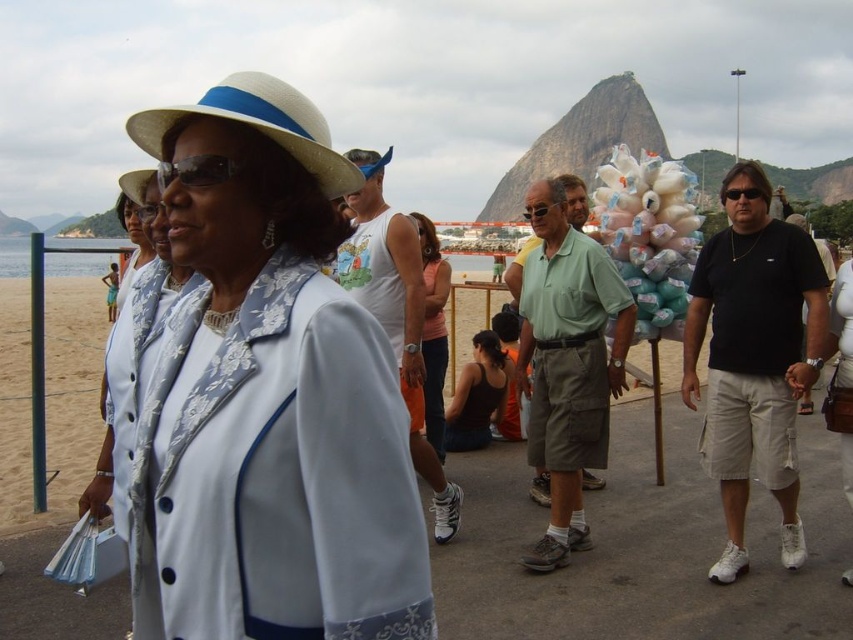
Is black cotton shirt at center above white tank top at center?

Actually, black cotton shirt at center is below white tank top at center.

Does black cotton shirt at center have a greater width compared to white tank top at center?

Indeed, black cotton shirt at center has a greater width compared to white tank top at center.

Does point (804, 358) come farther from viewer compared to point (355, 211)?

No, (804, 358) is closer to viewer.

The image size is (853, 640). I want to click on black cotton shirt at center, so click(x=753, y=356).

Is white fabric at center thinner than orange fabric tank top at center?

No.

Is point (86, 460) behind point (444, 291)?

No, (86, 460) is in front of (444, 291).

Is point (111, 593) positioned after point (428, 328)?

That is False.

Where is `white fabric at center`? white fabric at center is located at coordinates (643, 547).

Does point (152, 109) lie behind point (350, 196)?

That is False.

Is point (276, 432) less distant than point (432, 468)?

Yes.

Identify the location of matte white hat at upper left. This screenshot has width=853, height=640. (268, 396).